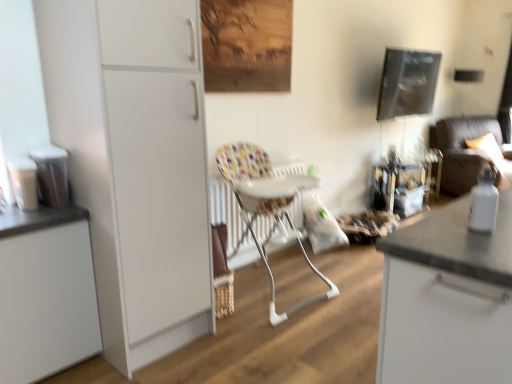
Locate an element on the screen. This screenshot has width=512, height=384. blank area beneath satin silver trash can at left, the 2th appliance from the left (from a real-world perspective) is located at coordinates (52, 209).